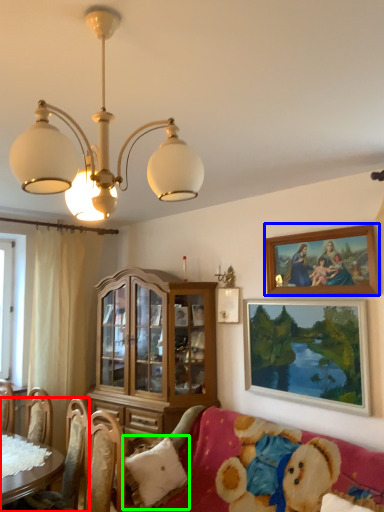
Question: Which is nearer to the chair (highlighted by a red box)? picture frame (highlighted by a blue box) or pillow (highlighted by a green box).

Choices:
 (A) picture frame
 (B) pillow

Answer: (B)